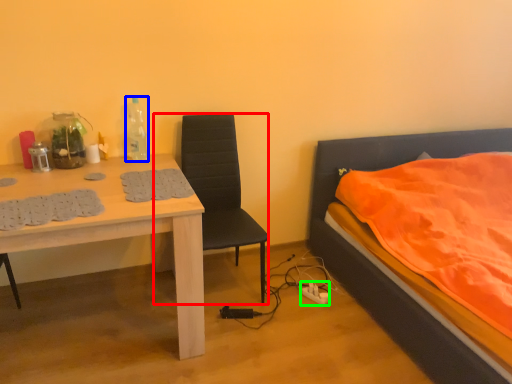
Question: Which object is the closest to the chair (highlighted by a red box)? Choose among these: bottle (highlighted by a blue box) or power outlet (highlighted by a green box).

Choices:
 (A) bottle
 (B) power outlet

Answer: (A)